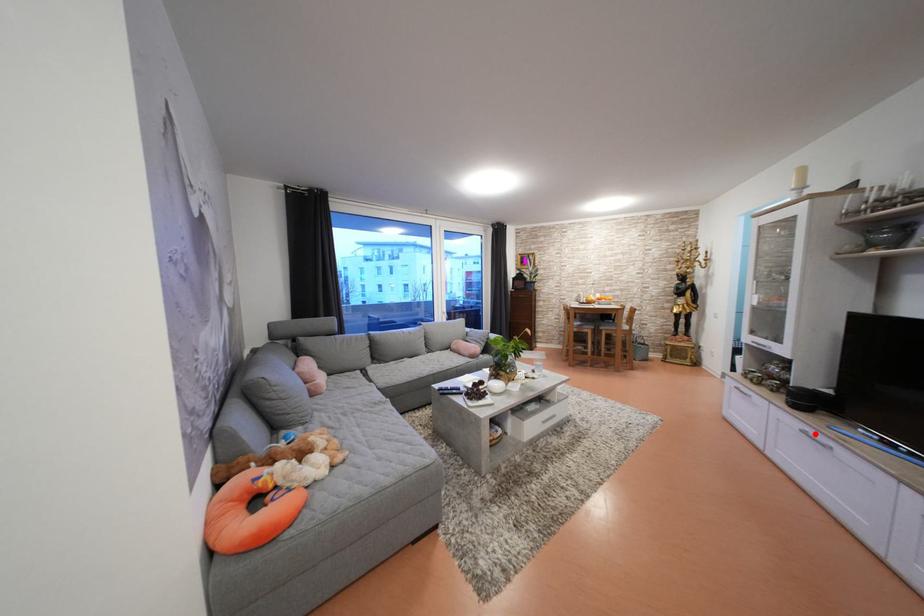
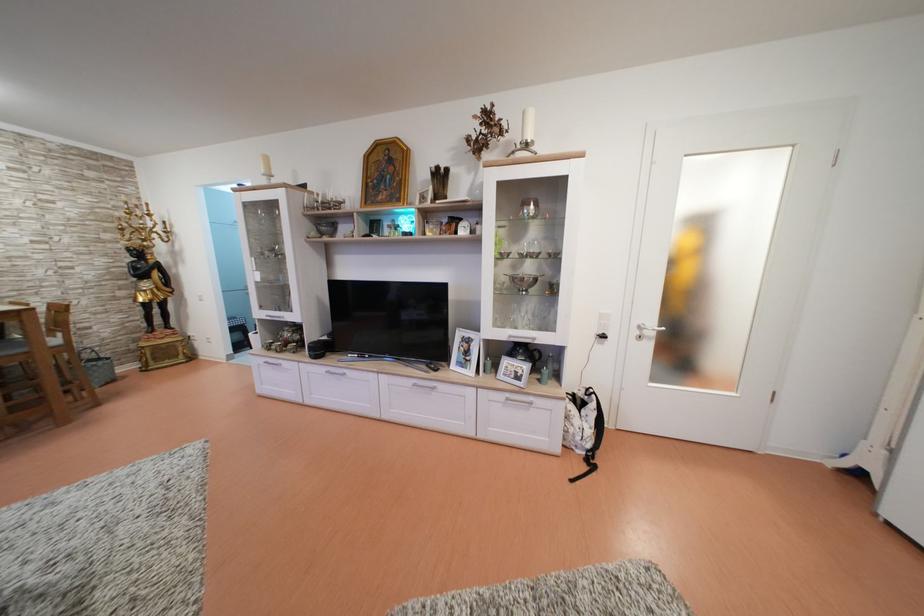
Locate, in the second image, the point that corresponds to the highlighted location in the first image.

(335, 374)